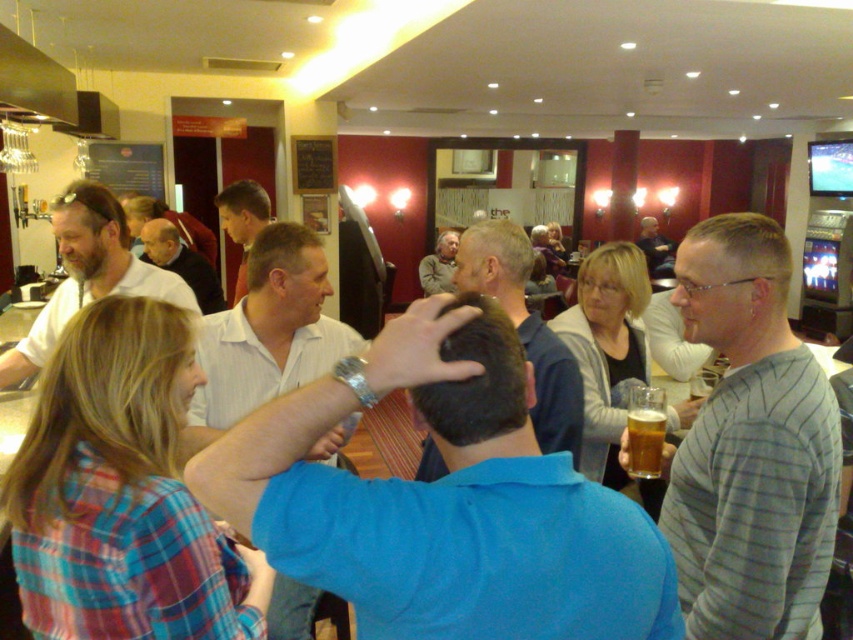
You are a bartender preparing to place a new drink on the counter. You notice the blue cotton shirt at center and the golden amber liquid at center. Will the drink fit on the counter between them without spilling?

The blue cotton shirt at center might be wider than golden amber liquid at center, so there might not be enough space between them for the drink. Check the distance carefully before placing it.

You are at a bar and want to order a drink. You see the white striped shirt at center and the light brown shirt at center. Which one is to the right of the other?

The white striped shirt at center is positioned on the right side of light brown shirt at center.